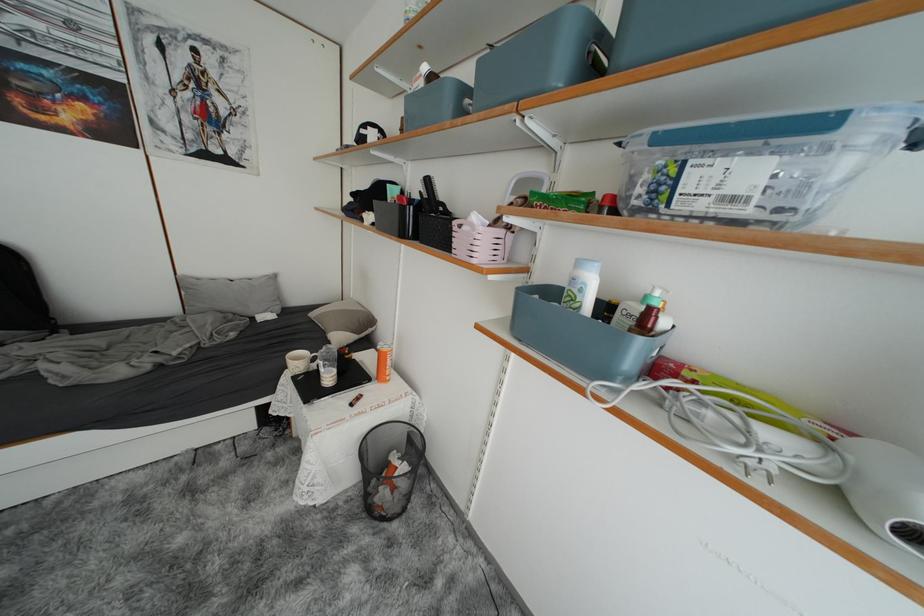
Where is `black bottle`? The width and height of the screenshot is (924, 616). black bottle is located at coordinates (649, 313).